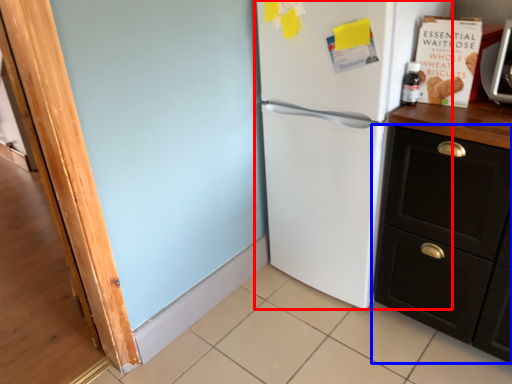
Question: Which object appears farthest to the camera in this image, refrigerator (highlighted by a red box) or cabinetry (highlighted by a blue box)?

Choices:
 (A) refrigerator
 (B) cabinetry

Answer: (A)